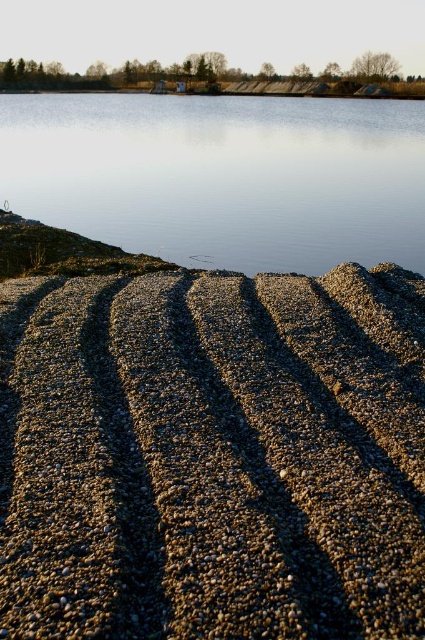
You are standing at the edge of the lake and want to walk towards the clear water at center. Are the brown pebbled gravel at lower center in your path?

Yes, the brown pebbled gravel at lower center are in your path because they are positioned in front of the clear water at center, meaning you would have to walk over them to reach the water.

You are standing at the edge of the lake and see two points marked in the scene. Point A is at coordinates point (x=311, y=552) and Point B is at point (x=360, y=156). Which point is closer to you?

Point A at point (x=311, y=552) is closer to you because it is in front of point (x=360, y=156).

You are standing at the edge of the lake and want to walk towards the clear water at center. Which direction should you move relative to the brown pebbled gravel at lower center?

You should move to the right of the brown pebbled gravel at lower center to reach the clear water at center since the brown pebbled gravel at lower center is to the left of clear water at center.